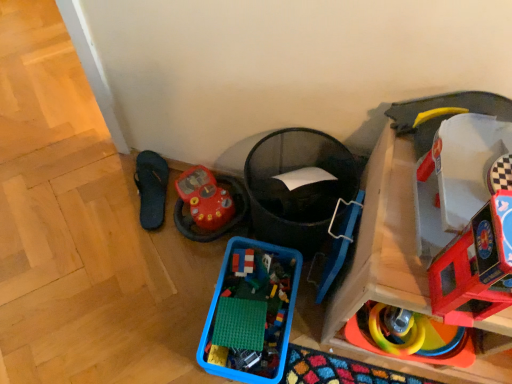
Question: Choose the correct answer: Is rubberized plastic rings at lower right, marked as the 3th toy in a right-to-left arrangement, inside smooth plastic toy car at right, arranged as the second toy when viewed from the right, or outside it?

Choices:
 (A) outside
 (B) inside

Answer: (A)

Question: Is rubberized plastic rings at lower right, marked as the fourth toy in a left-to-right arrangement, wider or thinner than smooth plastic toy car at right, the fifth toy viewed from the left?

Choices:
 (A) thin
 (B) wide

Answer: (B)

Question: Which is farther from the blue plastic container at lower center, placed as the 4th toy when sorted from right to left?

Choices:
 (A) black rubber flip-flop at lower left
 (B) translucent plastic bricks at center, which is counted as the fifth toy, starting from the right
 (C) smooth plastic toy car at right, the fifth toy viewed from the left
 (D) wooden toy car at right, the first toy viewed from the right
 (E) rubberized plastic rings at lower right, marked as the 3th toy in a right-to-left arrangement

Answer: (C)

Question: Estimate the real-world distances between objects in this image. Which object is farther from the wooden toy car at right, the first toy viewed from the right?

Choices:
 (A) smooth plastic toy car at right, the fifth toy viewed from the left
 (B) rubberized plastic toy car at lower left, positioned as the 6th toy in right-to-left order
 (C) rubberized plastic rings at lower right, marked as the 3th toy in a right-to-left arrangement
 (D) black rubber flip-flop at lower left
 (E) blue plastic container at lower center, which is the third toy from left to right

Answer: (D)